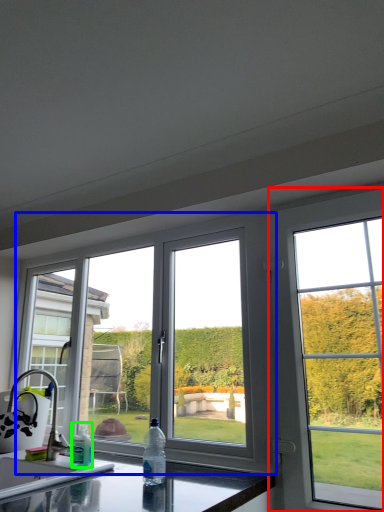
Question: Considering the real-world distances, which object is closest to window (highlighted by a red box)? window (highlighted by a blue box) or bottle (highlighted by a green box).

Choices:
 (A) window
 (B) bottle

Answer: (A)